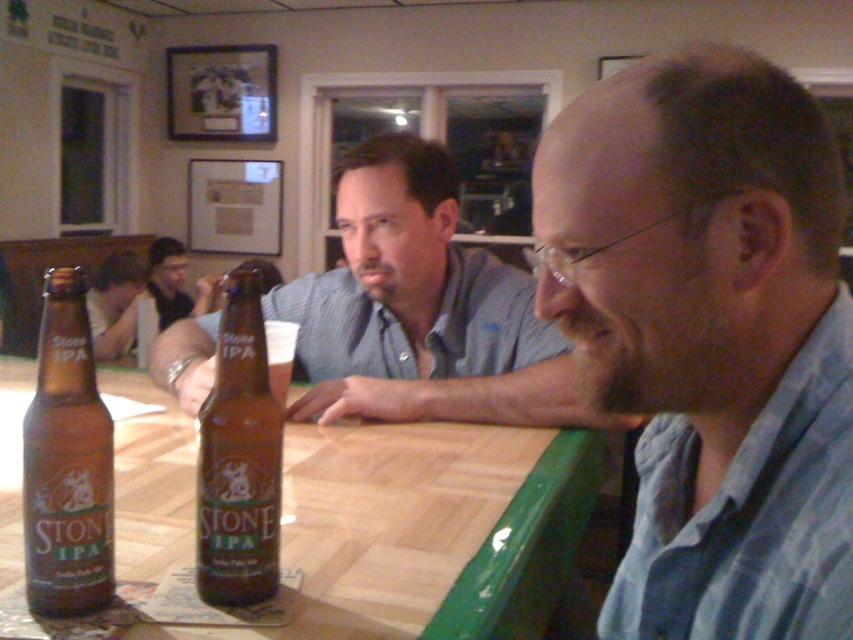
Can you confirm if wooden table at center is bigger than matte black shirt at center?

Yes.

Between point (405, 476) and point (157, 264), which one is positioned in front?

Positioned in front is point (405, 476).

Locate an element on the screen. wooden table at center is located at coordinates (427, 531).

Does matte brown shirt at center have a greater width compared to matte black shirt at center?

No.

Does matte brown shirt at center appear over matte black shirt at center?

No.

This screenshot has width=853, height=640. I want to click on matte brown shirt at center, so click(x=711, y=337).

You are a GUI agent. You are given a task and a screenshot of the screen. Output one action in this format:
    pyautogui.click(x=<x>, y=<y>)
    Task: Click on the matte brown shirt at center
    
    Given the screenshot: What is the action you would take?
    pyautogui.click(x=711, y=337)

Is matte glass beer bottle at center taller than brown glass bottle at bottle left?

Correct, matte glass beer bottle at center is much taller as brown glass bottle at bottle left.

Is matte glass beer bottle at center smaller than brown glass bottle at bottle left?

Incorrect, matte glass beer bottle at center is not smaller in size than brown glass bottle at bottle left.

Describe the element at coordinates (422, 310) in the screenshot. Image resolution: width=853 pixels, height=640 pixels. I see `matte glass beer bottle at center` at that location.

Find the location of `matte glass beer bottle at center`. matte glass beer bottle at center is located at coordinates (422, 310).